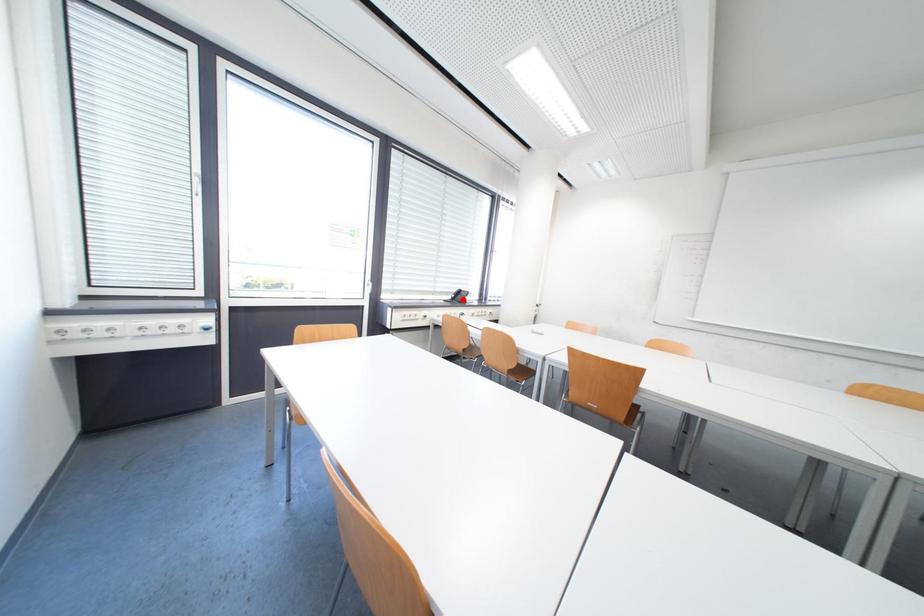
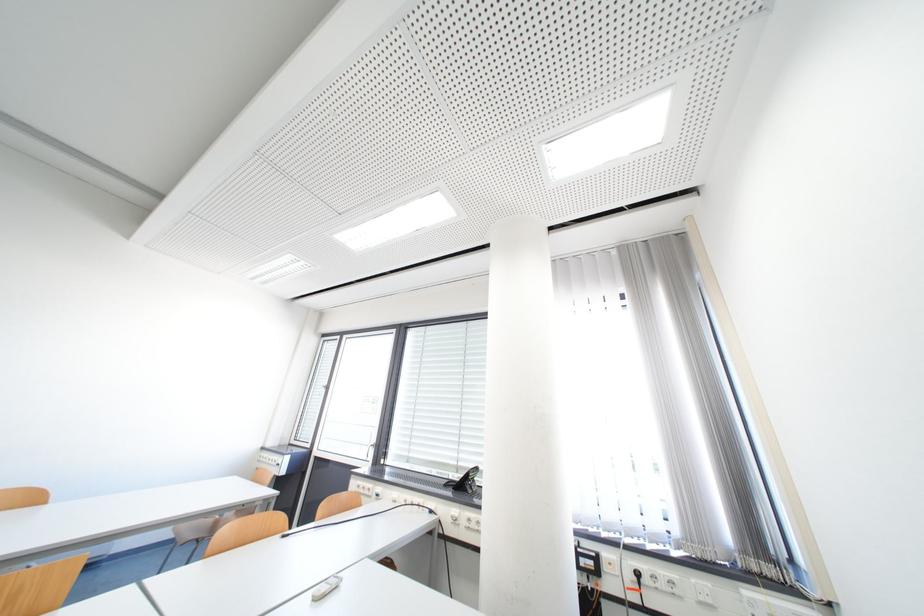
The point at the highlighted location is marked in the first image. Where is the corresponding point in the second image?

(478, 483)